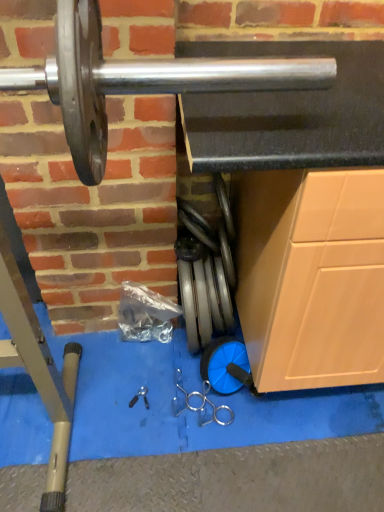
Question: Is silver metallic weight at center, which is the 1th tool from right to left, positioned beyond the bounds of black plastic tool at center, which appears as the 2th tool when viewed from the right?

Choices:
 (A) yes
 (B) no

Answer: (A)

Question: Is silver metallic weight at center, which is the 1th tool from right to left, oriented towards black plastic tool at center, which is the first tool in left-to-right order?

Choices:
 (A) no
 (B) yes

Answer: (A)

Question: From the image's perspective, does silver metallic weight at center, placed as the 2th tool when sorted from left to right, appear lower than black plastic tool at center, which is the first tool in left-to-right order?

Choices:
 (A) yes
 (B) no

Answer: (B)

Question: Is silver metallic weight at center, which is the 1th tool from right to left, oriented away from black plastic tool at center, which appears as the 2th tool when viewed from the right?

Choices:
 (A) no
 (B) yes

Answer: (A)

Question: Is silver metallic weight at center, placed as the 2th tool when sorted from left to right, shorter than black plastic tool at center, which is the first tool in left-to-right order?

Choices:
 (A) yes
 (B) no

Answer: (B)

Question: Considering the relative sizes of silver metallic weight at center, which is the 1th tool from right to left, and black plastic tool at center, which appears as the 2th tool when viewed from the right, in the image provided, is silver metallic weight at center, which is the 1th tool from right to left, bigger than black plastic tool at center, which appears as the 2th tool when viewed from the right,?

Choices:
 (A) no
 (B) yes

Answer: (B)

Question: From a real-world perspective, is black plastic tool at center, which is the first tool in left-to-right order, below silver metallic weight at center, placed as the 2th tool when sorted from left to right?

Choices:
 (A) yes
 (B) no

Answer: (A)

Question: Is silver metallic weight at center, placed as the 2th tool when sorted from left to right, at the back of black plastic tool at center, which is the first tool in left-to-right order?

Choices:
 (A) no
 (B) yes

Answer: (A)

Question: Would you say silver metallic weight at center, placed as the 2th tool when sorted from left to right, is part of black plastic tool at center, which is the first tool in left-to-right order,'s contents?

Choices:
 (A) no
 (B) yes

Answer: (A)

Question: Considering the relative sizes of black plastic tool at center, which is the first tool in left-to-right order, and silver metallic weight at center, placed as the 2th tool when sorted from left to right, in the image provided, is black plastic tool at center, which is the first tool in left-to-right order, thinner than silver metallic weight at center, placed as the 2th tool when sorted from left to right,?

Choices:
 (A) yes
 (B) no

Answer: (A)

Question: Does black plastic tool at center, which is the first tool in left-to-right order, come in front of silver metallic weight at center, placed as the 2th tool when sorted from left to right?

Choices:
 (A) yes
 (B) no

Answer: (B)

Question: Is black plastic tool at center, which appears as the 2th tool when viewed from the right, touching silver metallic weight at center, placed as the 2th tool when sorted from left to right?

Choices:
 (A) no
 (B) yes

Answer: (A)

Question: Relative to black plastic tool at center, which is the first tool in left-to-right order, is silver metallic weight at center, which is the 1th tool from right to left, in front or behind?

Choices:
 (A) behind
 (B) front

Answer: (B)